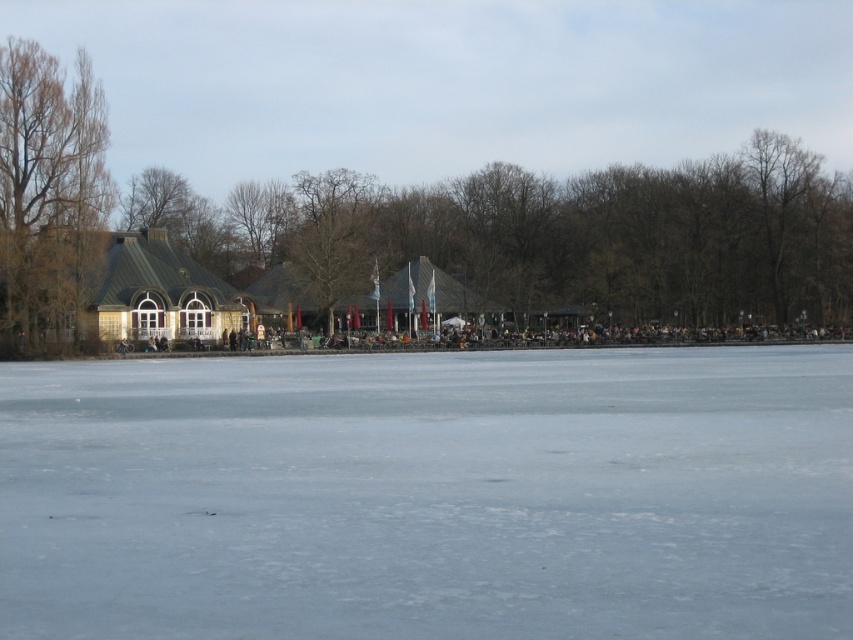
Between transparent ice at center and brown leafless tree at left, which one is positioned higher?

Positioned higher is brown leafless tree at left.

Is transparent ice at center to the right of brown leafless tree at left from the viewer's perspective?

Yes, transparent ice at center is to the right of brown leafless tree at left.

What do you see at coordinates (430, 493) in the screenshot? I see `transparent ice at center` at bounding box center [430, 493].

I want to click on transparent ice at center, so click(430, 493).